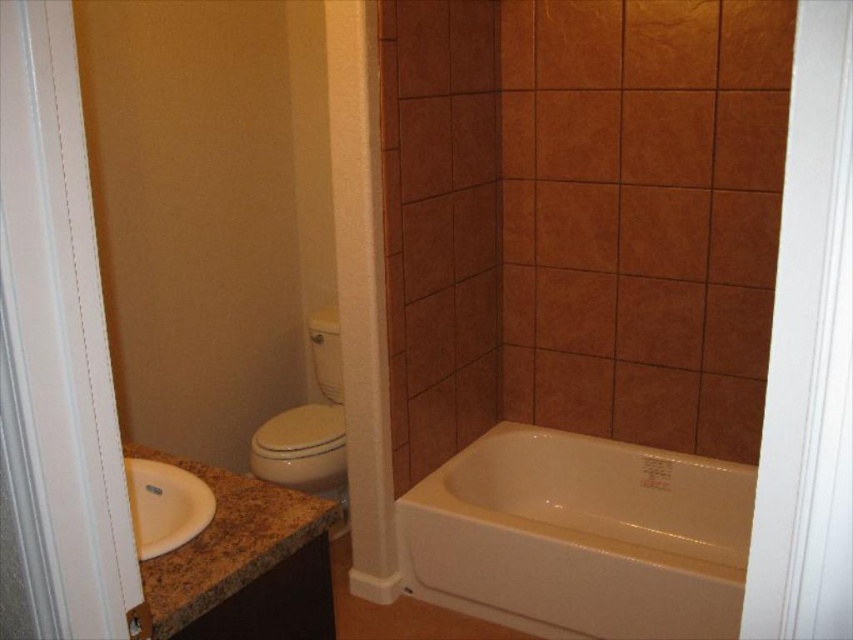
You are standing in the bathroom shown in the image. There is a point marked at coordinates (310, 428). What object is located at this point?

The white glossy toilet bowl at center left is located at point (310, 428).